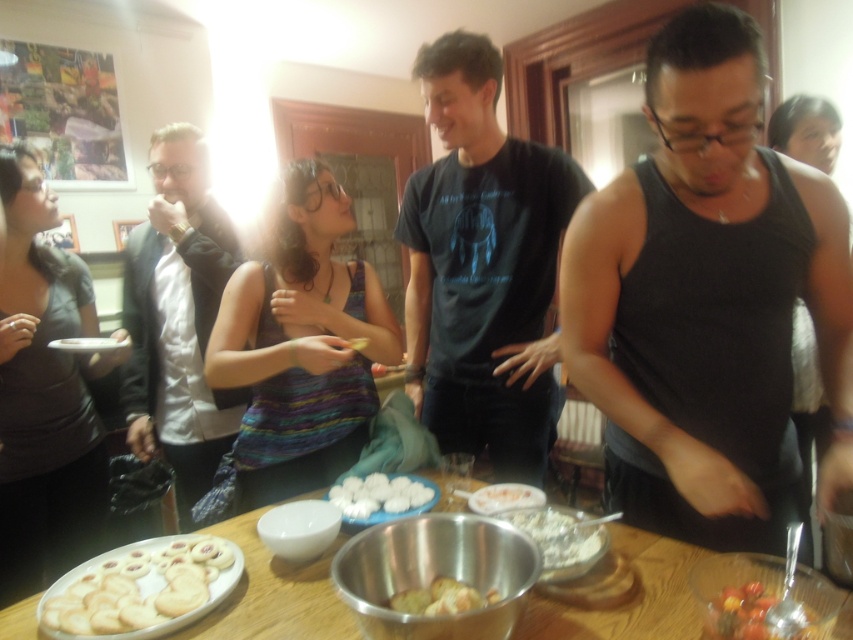
You are a guest at the party and want to make a snack using both the white powdery flour at center and the white fluffy marshmallows at center. To mix them properly, you need to know which one has a larger surface area. Based on the scene, which one do you think has a wider base?

The white powdery flour at center might be wider than white fluffy marshmallows at center according to the description, so the flour likely has a larger surface area for mixing.

You are at the party and want to grab a snack from the table. There are two points on the table marked as point (572,554) and point (471,508). Which point is closer to you?

Point (572,554) is closer to the viewer than point (471,508).